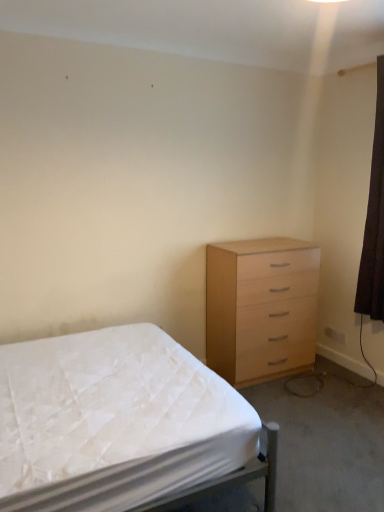
Identify the location of light wood chest of drawers at right. The image size is (384, 512). (260, 307).

Considering the relative sizes of brown fabric curtain at right and white fabric bed at lower left in the image provided, is brown fabric curtain at right wider than white fabric bed at lower left?

Incorrect, the width of brown fabric curtain at right does not surpass that of white fabric bed at lower left.

Which is more to the left, brown fabric curtain at right or white fabric bed at lower left?

Positioned to the left is white fabric bed at lower left.

Is brown fabric curtain at right touching white fabric bed at lower left?

No, brown fabric curtain at right is not next to white fabric bed at lower left.

Is white fabric bed at lower left completely or partially inside brown fabric curtain at right?

That's incorrect, white fabric bed at lower left is not inside brown fabric curtain at right.

Find the location of a particular element. This screenshot has height=512, width=384. curtain above the white fabric bed at lower left (from a real-world perspective) is located at coordinates (374, 221).

Is point (25, 425) closer to viewer compared to point (361, 258)?

Yes, it is.

Would you say white fabric bed at lower left is outside brown fabric curtain at right?

Yes, white fabric bed at lower left is outside of brown fabric curtain at right.

Is white fabric bed at lower left next to brown fabric curtain at right?

They are not placed beside each other.

Is light wood chest of drawers at right next to brown fabric curtain at right?

light wood chest of drawers at right and brown fabric curtain at right are not in contact.

From the image's perspective, which is below, light wood chest of drawers at right or brown fabric curtain at right?

light wood chest of drawers at right.

From a real-world perspective, who is located higher, light wood chest of drawers at right or brown fabric curtain at right?

brown fabric curtain at right, from a real-world perspective.

What's the angular difference between light wood chest of drawers at right and brown fabric curtain at right's facing directions?

The angular difference between light wood chest of drawers at right and brown fabric curtain at right is 89.5 degrees.

Is light wood chest of drawers at right a part of brown fabric curtain at right?

No, light wood chest of drawers at right is not surrounded by brown fabric curtain at right.

Find the location of `chest of drawers below the brown fabric curtain at right (from the image's perspective)`. chest of drawers below the brown fabric curtain at right (from the image's perspective) is located at coordinates (260, 307).

Between brown fabric curtain at right and light wood chest of drawers at right, which one is positioned in front?

brown fabric curtain at right is in front.

Based on the photo, what's the angular difference between brown fabric curtain at right and light wood chest of drawers at right's facing directions?

They differ by 89.5 degrees in their facing directions.

Locate an element on the screen. This screenshot has width=384, height=512. bed directly beneath the light wood chest of drawers at right (from a real-world perspective) is located at coordinates (121, 425).

How much distance is there between white fabric bed at lower left and light wood chest of drawers at right?

white fabric bed at lower left and light wood chest of drawers at right are 1.07 meters apart.

Does white fabric bed at lower left have a greater width compared to light wood chest of drawers at right?

Yes.

Is white fabric bed at lower left facing towards light wood chest of drawers at right?

Yes, white fabric bed at lower left is aimed at light wood chest of drawers at right.

Is light wood chest of drawers at right turned away from white fabric bed at lower left?

No.

Who is shorter, light wood chest of drawers at right or white fabric bed at lower left?

white fabric bed at lower left.

From the image's perspective, is light wood chest of drawers at right above or below white fabric bed at lower left?

Based on their image positions, light wood chest of drawers at right is located above white fabric bed at lower left.

Identify the location of bed lying in front of the brown fabric curtain at right. (121, 425).

Where is `bed below the brown fabric curtain at right (from a real-world perspective)`? The width and height of the screenshot is (384, 512). bed below the brown fabric curtain at right (from a real-world perspective) is located at coordinates pos(121,425).

When comparing their distances from white fabric bed at lower left, does brown fabric curtain at right or light wood chest of drawers at right seem further?

brown fabric curtain at right is positioned further to the anchor white fabric bed at lower left.

From the image, which object appears to be farther from brown fabric curtain at right, white fabric bed at lower left or light wood chest of drawers at right?

The object further to brown fabric curtain at right is white fabric bed at lower left.

Based on their spatial positions, is brown fabric curtain at right or white fabric bed at lower left further from light wood chest of drawers at right?

white fabric bed at lower left.

Based on their spatial positions, is light wood chest of drawers at right or white fabric bed at lower left further from brown fabric curtain at right?

white fabric bed at lower left is further to brown fabric curtain at right.

Looking at the image, which one is located further to light wood chest of drawers at right, white fabric bed at lower left or brown fabric curtain at right?

The object further to light wood chest of drawers at right is white fabric bed at lower left.

Consider the image. Looking at the image, which one is located closer to white fabric bed at lower left, light wood chest of drawers at right or brown fabric curtain at right?

light wood chest of drawers at right is closer to white fabric bed at lower left.

Where is `curtain between white fabric bed at lower left and light wood chest of drawers at right in the front-back direction`? This screenshot has height=512, width=384. curtain between white fabric bed at lower left and light wood chest of drawers at right in the front-back direction is located at coordinates (374, 221).